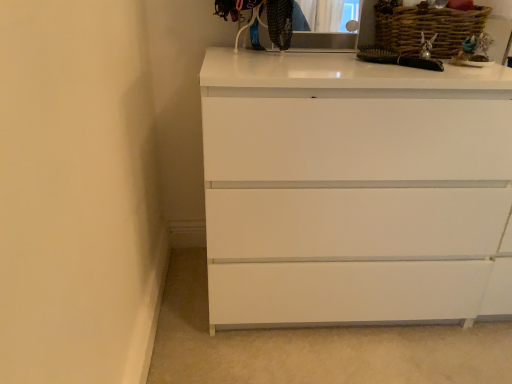
Question: Is woven brown basket at upper right surrounded by matte black medicine cabinet at upper center?

Choices:
 (A) no
 (B) yes

Answer: (A)

Question: Considering the relative sizes of matte black medicine cabinet at upper center and woven brown basket at upper right in the image provided, is matte black medicine cabinet at upper center wider than woven brown basket at upper right?

Choices:
 (A) no
 (B) yes

Answer: (A)

Question: From the image's perspective, is matte black medicine cabinet at upper center beneath woven brown basket at upper right?

Choices:
 (A) no
 (B) yes

Answer: (A)

Question: Does matte black medicine cabinet at upper center have a smaller size compared to woven brown basket at upper right?

Choices:
 (A) yes
 (B) no

Answer: (A)

Question: Is matte black medicine cabinet at upper center oriented towards woven brown basket at upper right?

Choices:
 (A) no
 (B) yes

Answer: (A)

Question: Is matte black medicine cabinet at upper center far away from woven brown basket at upper right?

Choices:
 (A) no
 (B) yes

Answer: (A)

Question: Is white glossy chest of drawers at center positioned behind matte black medicine cabinet at upper center?

Choices:
 (A) no
 (B) yes

Answer: (A)

Question: Is white glossy chest of drawers at center positioned with its back to matte black medicine cabinet at upper center?

Choices:
 (A) yes
 (B) no

Answer: (B)

Question: Can you confirm if white glossy chest of drawers at center is shorter than matte black medicine cabinet at upper center?

Choices:
 (A) no
 (B) yes

Answer: (A)

Question: Is there a large distance between white glossy chest of drawers at center and matte black medicine cabinet at upper center?

Choices:
 (A) yes
 (B) no

Answer: (B)

Question: Is white glossy chest of drawers at center thinner than matte black medicine cabinet at upper center?

Choices:
 (A) yes
 (B) no

Answer: (B)

Question: Considering the relative positions of white glossy chest of drawers at center and matte black medicine cabinet at upper center in the image provided, is white glossy chest of drawers at center to the left of matte black medicine cabinet at upper center from the viewer's perspective?

Choices:
 (A) yes
 (B) no

Answer: (B)

Question: Is woven brown basket at upper right not within matte black medicine cabinet at upper center?

Choices:
 (A) yes
 (B) no

Answer: (A)